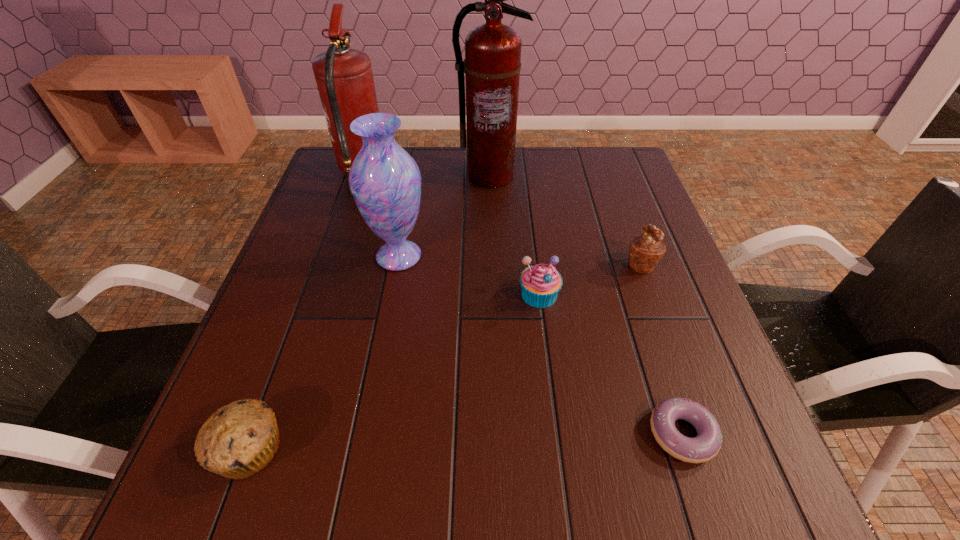
Select which object is the sixth closest to the left fire extinguisher. Please provide its 2D coordinates. Your answer should be formatted as a tuple, i.e. [(x, y)], where the tuple contains the x and y coordinates of a point satisfying the conditions above.

[(707, 443)]

Where is `the third closest object relative to the vase`? the third closest object relative to the vase is located at coordinates (492, 64).

The image size is (960, 540). Find the location of `the closest muffin to the rightmost muffin`. the closest muffin to the rightmost muffin is located at coordinates (540, 283).

Identify which muffin is the closest to the second farthest muffin. Please provide its 2D coordinates. Your answer should be formatted as a tuple, i.e. [(x, y)], where the tuple contains the x and y coordinates of a point satisfying the conditions above.

[(646, 250)]

You are a GUI agent. You are given a task and a screenshot of the screen. Output one action in this format:
    pyautogui.click(x=<x>, y=<y>)
    Task: Click on the vacant space that satisfies the following two spatial constraints: 1. at the front of the left fire extinguisher where the nozzle is aimed; 2. on the left side of the rightmost muffin
    Image resolution: width=960 pixels, height=540 pixels.
    Given the screenshot: What is the action you would take?
    pyautogui.click(x=333, y=264)

Image resolution: width=960 pixels, height=540 pixels. Identify the location of free location that satisfies the following two spatial constraints: 1. at the front of the left fire extinguisher where the nozzle is aimed; 2. on the left side of the third object from left to right. (336, 256).

Identify the location of vacant area in the image that satisfies the following two spatial constraints: 1. on the back side of the shortest object; 2. at the front of the left fire extinguisher where the nozzle is aimed. This screenshot has width=960, height=540. (597, 175).

Locate an element on the screen. vacant area in the image that satisfies the following two spatial constraints: 1. at the front of the rightmost muffin where the nozzle is aimed; 2. on the left side of the left fire extinguisher is located at coordinates (333, 264).

Where is `free point that satisfies the following two spatial constraints: 1. at the front of the left fire extinguisher where the nozzle is aimed; 2. on the back side of the farthest muffin`? The height and width of the screenshot is (540, 960). free point that satisfies the following two spatial constraints: 1. at the front of the left fire extinguisher where the nozzle is aimed; 2. on the back side of the farthest muffin is located at coordinates (333, 264).

This screenshot has width=960, height=540. I want to click on vacant space that satisfies the following two spatial constraints: 1. on the front side of the second farthest muffin; 2. on the right side of the vase, so click(x=392, y=294).